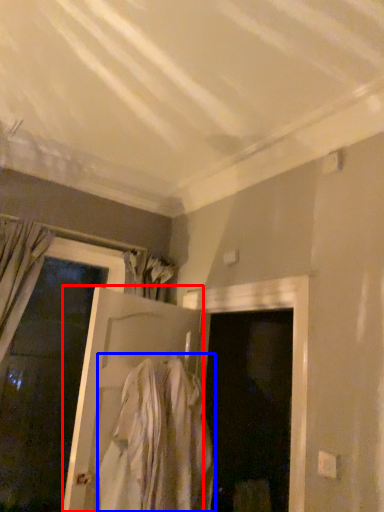
Question: Which object is further to the camera taking this photo, door (highlighted by a red box) or clothing (highlighted by a blue box)?

Choices:
 (A) door
 (B) clothing

Answer: (A)